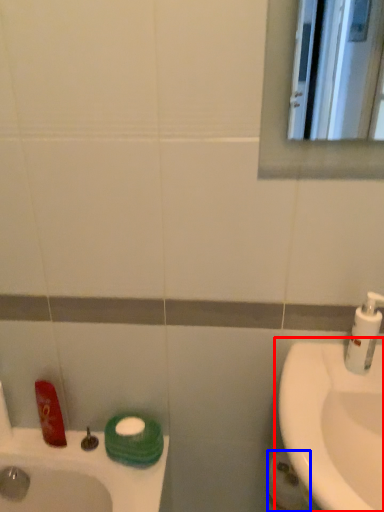
Question: Among these objects, which one is farthest to the camera, sink (highlighted by a red box) or toilet paper (highlighted by a blue box)?

Choices:
 (A) sink
 (B) toilet paper

Answer: (B)